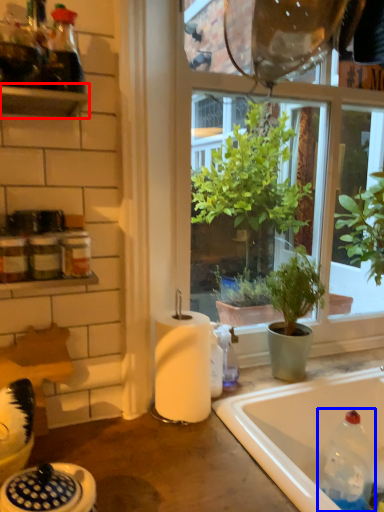
Question: Which object appears closest to the camera in this image, shelf (highlighted by a red box) or bottle (highlighted by a blue box)?

Choices:
 (A) shelf
 (B) bottle

Answer: (A)